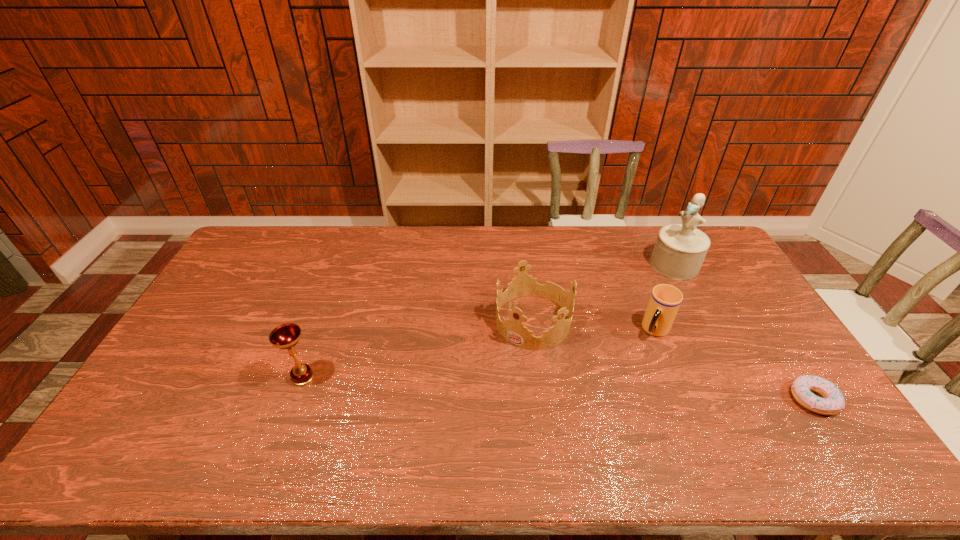
What are the coordinates of `vacant space on the desktop that is between the leftmost object and the doughnut and is positioned at the beak of the figurine` in the screenshot? It's located at (512, 386).

What are the coordinates of `free spot on the desktop that is between the chalice and the shortest object and is positioned on the front-facing side of the second object from left to right` in the screenshot? It's located at (485, 385).

This screenshot has height=540, width=960. What are the coordinates of `free spot on the desktop that is between the leftmost object and the doughnut and is positioned on the side of the cup with the handle` in the screenshot? It's located at [616, 390].